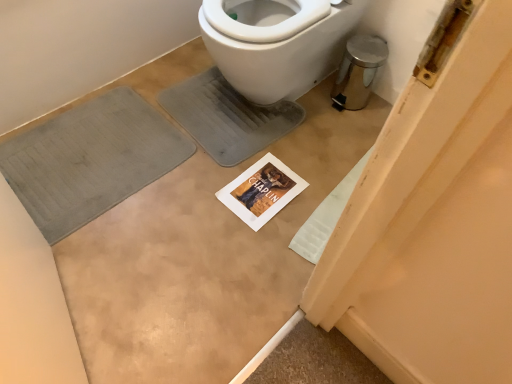
You are a GUI agent. You are given a task and a screenshot of the screen. Output one action in this format:
    pyautogui.click(x=<x>, y=<y>)
    Task: Click on the white plastic bidet at upper center
    
    Given the screenshot: What is the action you would take?
    pyautogui.click(x=277, y=43)

This screenshot has height=384, width=512. What do you see at coordinates (277, 43) in the screenshot?
I see `white plastic bidet at upper center` at bounding box center [277, 43].

Identify the location of gray fabric bath mat at lower left. (90, 160).

The width and height of the screenshot is (512, 384). What do you see at coordinates (90, 160) in the screenshot?
I see `gray fabric bath mat at lower left` at bounding box center [90, 160].

This screenshot has width=512, height=384. In order to click on white plastic bidet at upper center in this screenshot , I will do `click(277, 43)`.

Considering the positions of objects white plastic bidet at upper center and gray fabric bath mat at lower left in the image provided, who is more to the right, white plastic bidet at upper center or gray fabric bath mat at lower left?

white plastic bidet at upper center is more to the right.

Is the depth of white plastic bidet at upper center greater than that of gray fabric bath mat at lower left?

No, white plastic bidet at upper center is in front of gray fabric bath mat at lower left.

Which is further, [257,5] or [154,161]?

Point [154,161]

From the image's perspective, which one is positioned higher, white plastic bidet at upper center or gray fabric bath mat at lower left?

From the image's view, white plastic bidet at upper center is above.

From a real-world perspective, is white plastic bidet at upper center physically below gray fabric bath mat at lower left?

No, from a real-world perspective, white plastic bidet at upper center is not below gray fabric bath mat at lower left.

From the picture: Is white plastic bidet at upper center wider or thinner than gray fabric bath mat at lower left?

Considering their sizes, white plastic bidet at upper center looks broader than gray fabric bath mat at lower left.

Does white plastic bidet at upper center have a greater height compared to gray fabric bath mat at lower left?

Yes.

Looking at this image, does white plastic bidet at upper center have a smaller size compared to gray fabric bath mat at lower left?

Incorrect, white plastic bidet at upper center is not smaller in size than gray fabric bath mat at lower left.

Do you think white plastic bidet at upper center is within gray fabric bath mat at lower left, or outside of it?

white plastic bidet at upper center is not inside gray fabric bath mat at lower left, it's outside.

Is white plastic bidet at upper center positioned far away from gray fabric bath mat at lower left?

Actually, white plastic bidet at upper center and gray fabric bath mat at lower left are a little close together.

Is white plastic bidet at upper center turned away from gray fabric bath mat at lower left?

white plastic bidet at upper center is not turned away from gray fabric bath mat at lower left.

Can you tell me how much white plastic bidet at upper center and gray fabric bath mat at lower left differ in facing direction?

91.4 degrees.

How distant is white plastic bidet at upper center from gray fabric bath mat at lower left?

white plastic bidet at upper center is 22.00 inches away from gray fabric bath mat at lower left.

This screenshot has height=384, width=512. I want to click on bath mat lying below the white plastic bidet at upper center (from the image's perspective), so [x=90, y=160].

Does gray fabric bath mat at lower left appear on the right side of white plastic bidet at upper center?

No, gray fabric bath mat at lower left is not to the right of white plastic bidet at upper center.

Does gray fabric bath mat at lower left lie in front of white plastic bidet at upper center?

That is False.

Between point (40, 201) and point (213, 3), which one is positioned behind?

Point (40, 201)

From the image's perspective, is gray fabric bath mat at lower left over white plastic bidet at upper center?

Actually, gray fabric bath mat at lower left appears below white plastic bidet at upper center in the image.

From a real-world perspective, is gray fabric bath mat at lower left physically above white plastic bidet at upper center?

No, from a real-world perspective, gray fabric bath mat at lower left is not over white plastic bidet at upper center

Which object is wider, gray fabric bath mat at lower left or white plastic bidet at upper center?

white plastic bidet at upper center.

Which of these two, gray fabric bath mat at lower left or white plastic bidet at upper center, stands shorter?

With less height is gray fabric bath mat at lower left.

Between gray fabric bath mat at lower left and white plastic bidet at upper center, which one has smaller size?

With smaller size is gray fabric bath mat at lower left.

Is gray fabric bath mat at lower left spatially inside white plastic bidet at upper center, or outside of it?

gray fabric bath mat at lower left lies outside white plastic bidet at upper center.

From the picture: Can you see gray fabric bath mat at lower left touching white plastic bidet at upper center?

No, gray fabric bath mat at lower left is not beside white plastic bidet at upper center.

Is gray fabric bath mat at lower left oriented towards white plastic bidet at upper center?

No, gray fabric bath mat at lower left is not facing towards white plastic bidet at upper center.

How much distance is there between gray fabric bath mat at lower left and white plastic bidet at upper center?

gray fabric bath mat at lower left is 22.00 inches from white plastic bidet at upper center.

This screenshot has height=384, width=512. I want to click on bath mat behind the white plastic bidet at upper center, so click(x=90, y=160).

Image resolution: width=512 pixels, height=384 pixels. What are the coordinates of `bath mat that is on the left side of white plastic bidet at upper center` in the screenshot? It's located at (90, 160).

At what (x,y) coordinates should I click in order to perform the action: click on bidet above the gray fabric bath mat at lower left (from a real-world perspective). Please return your answer as a coordinate pair (x, y). This screenshot has width=512, height=384. Looking at the image, I should click on (277, 43).